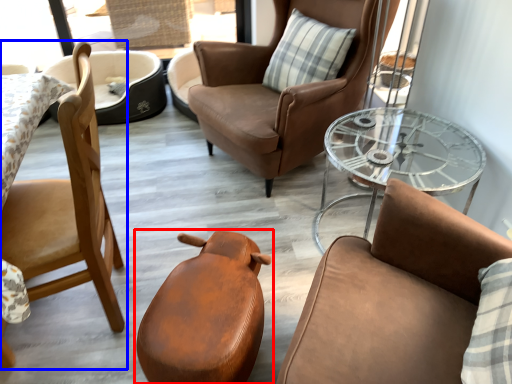
Question: Among these objects, which one is nearest to the camera, chair (highlighted by a red box) or chair (highlighted by a blue box)?

Choices:
 (A) chair
 (B) chair

Answer: (B)